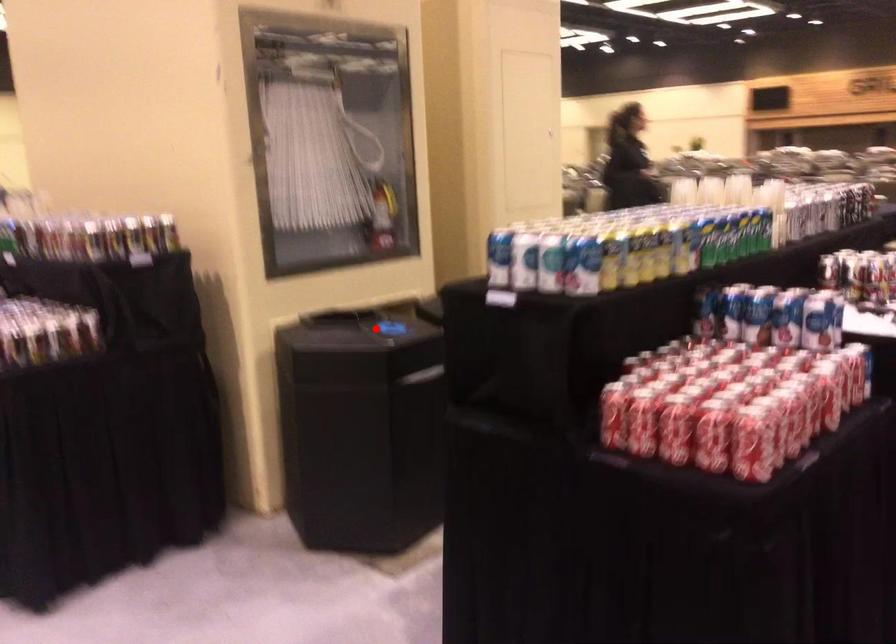
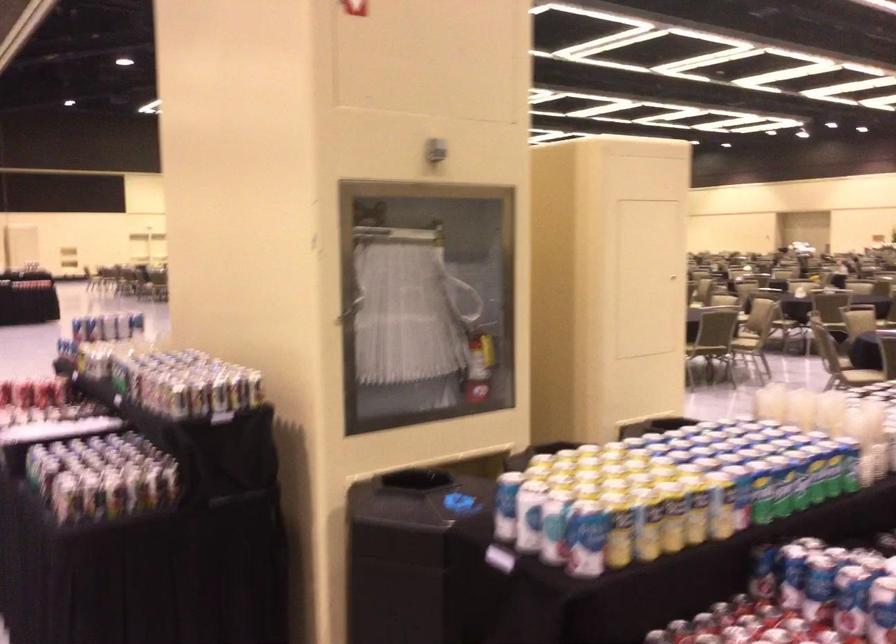
The point at the highlighted location is marked in the first image. Where is the corresponding point in the second image?

(442, 502)